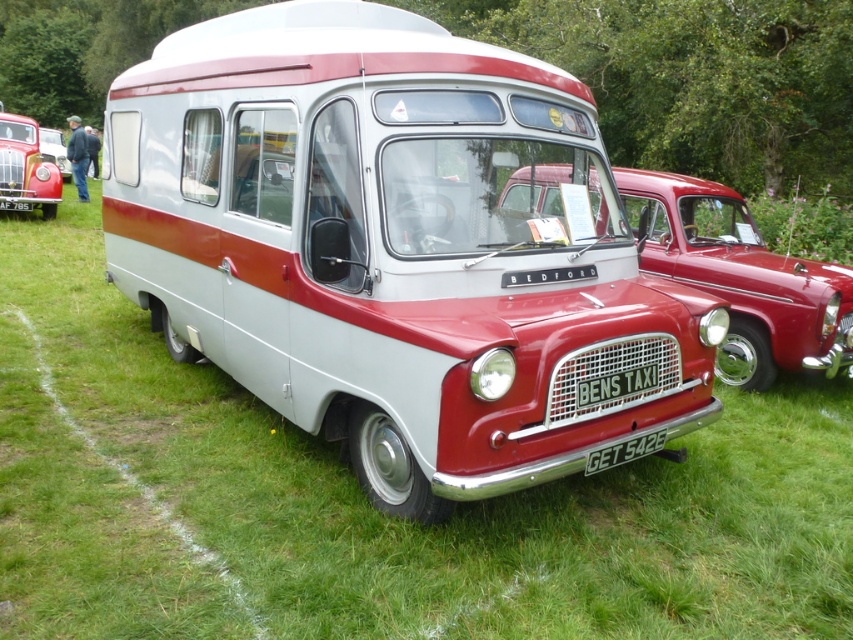
Question: Which object is positioned farthest from the matte red van at center?

Choices:
 (A) matte red taxi at center
 (B) green grass at center

Answer: (A)

Question: Does matte red taxi at center appear on the right side of matte red van at center?

Choices:
 (A) no
 (B) yes

Answer: (B)

Question: Which point is closer to the camera?

Choices:
 (A) matte white/red van at center
 (B) shiny red car at left
 (C) matte red van at center
 (D) green grass at center

Answer: (D)

Question: Does green grass at center have a lesser width compared to shiny red car at left?

Choices:
 (A) yes
 (B) no

Answer: (B)

Question: Which point is farther to the camera?

Choices:
 (A) (709, 516)
 (B) (62, 156)

Answer: (B)

Question: Can you confirm if matte white/red van at center is bigger than shiny red car at left?

Choices:
 (A) yes
 (B) no

Answer: (A)